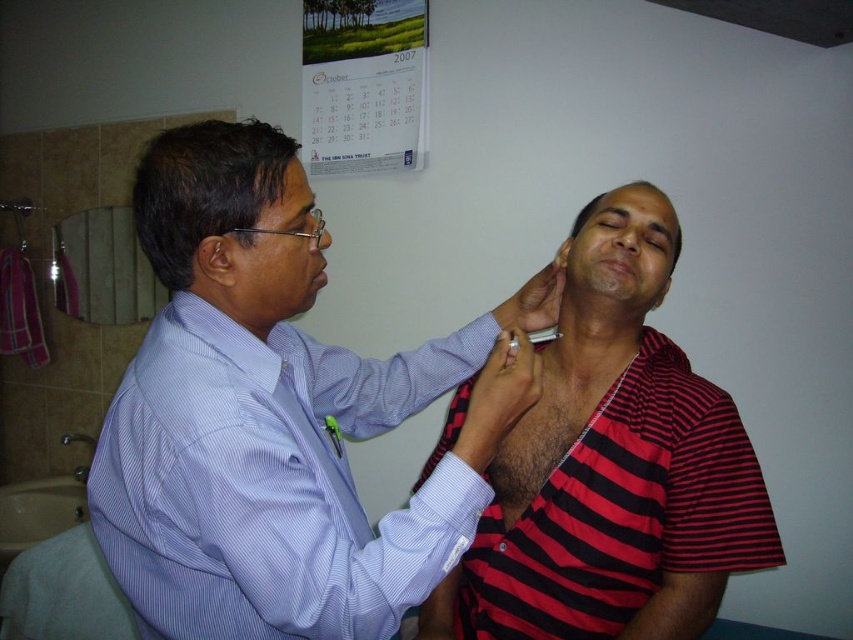
Question: Observing the image, what is the correct spatial positioning of blue striped shirt at upper left in reference to red striped shirt at center?

Choices:
 (A) left
 (B) right

Answer: (A)

Question: Which of the following is the farthest from the observer?

Choices:
 (A) (241, 458)
 (B) (660, 460)

Answer: (B)

Question: Which point appears farthest from the camera in this image?

Choices:
 (A) (490, 545)
 (B) (254, 547)

Answer: (A)

Question: Is blue striped shirt at upper left to the left of red striped shirt at center from the viewer's perspective?

Choices:
 (A) no
 (B) yes

Answer: (B)

Question: Which point is closer to the camera?

Choices:
 (A) blue striped shirt at upper left
 (B) red striped shirt at center

Answer: (A)

Question: Is blue striped shirt at upper left in front of red striped shirt at center?

Choices:
 (A) yes
 (B) no

Answer: (A)